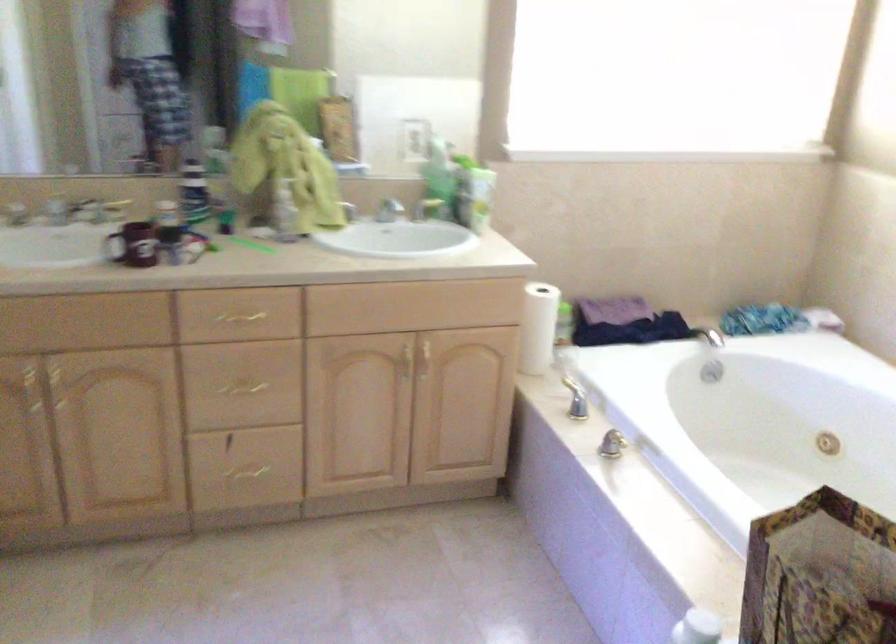
Find where to push the soap pump. Please return your answer as a coordinate pair (x, y).

(285, 211)